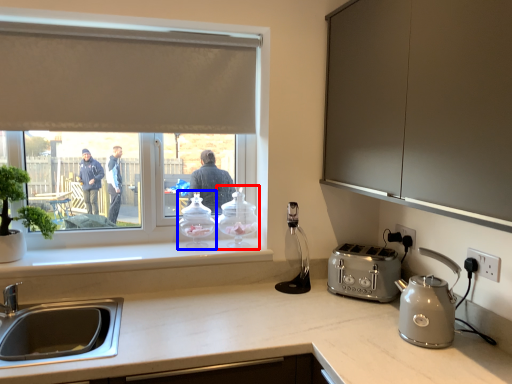
Question: Which object appears closest to the camera in this image, kitchen appliance (highlighted by a red box) or kitchen appliance (highlighted by a blue box)?

Choices:
 (A) kitchen appliance
 (B) kitchen appliance

Answer: (B)